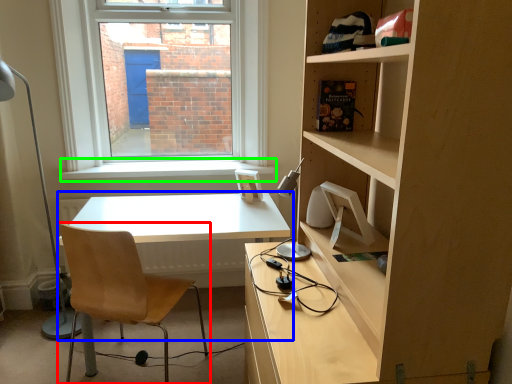
Question: Which is nearer to the chair (highlighted by a red box)? table (highlighted by a blue box) or window sill (highlighted by a green box).

Choices:
 (A) table
 (B) window sill

Answer: (A)